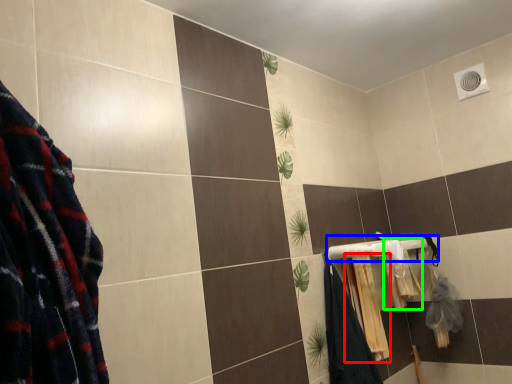
Question: Estimate the real-world distances between objects in this image. Which object is closer to bath towel (highlighted by a red box), towel bar (highlighted by a blue box) or bath towel (highlighted by a green box)?

Choices:
 (A) towel bar
 (B) bath towel

Answer: (A)